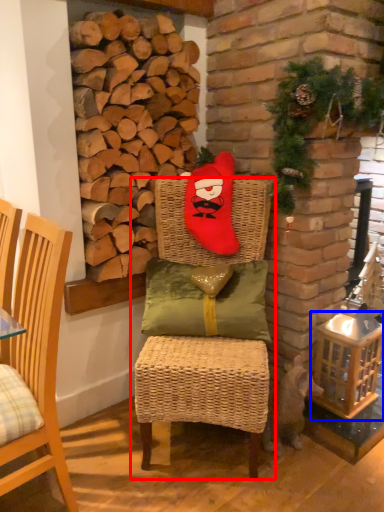
Question: Which of the following is the closest to the observer, chair (highlighted by a red box) or basket (highlighted by a blue box)?

Choices:
 (A) chair
 (B) basket

Answer: (A)